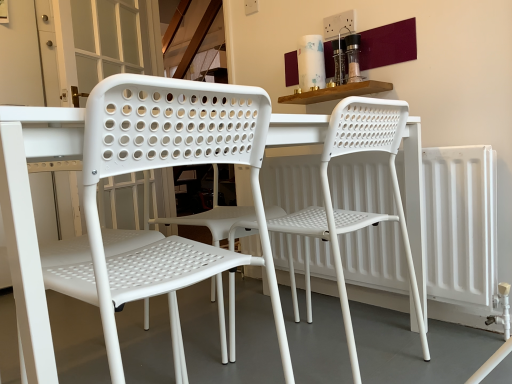
What are the coordinates of `vacant area situated below white plastic chair at center, placed as the 2th chair when sorted from left to right (from a real-world perspective)` in the screenshot? It's located at (328, 356).